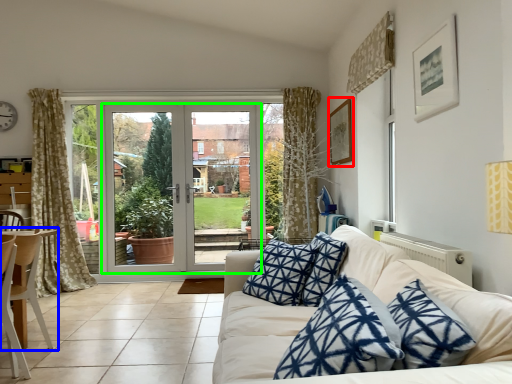
Question: Which is nearer to the picture frame (highlighted by a red box)? chair (highlighted by a blue box) or door (highlighted by a green box).

Choices:
 (A) chair
 (B) door

Answer: (B)